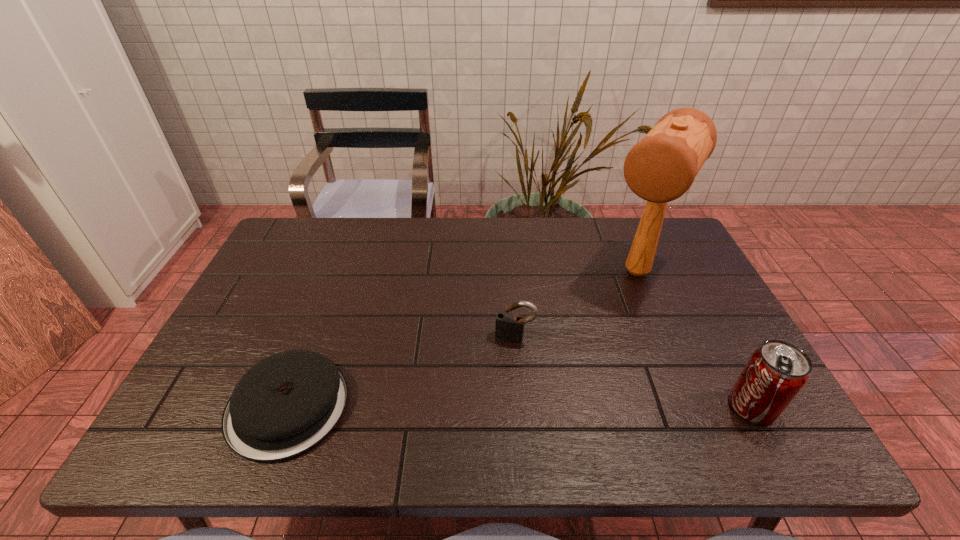
Where is `free space located on the strike surface of the mallet`? This screenshot has width=960, height=540. free space located on the strike surface of the mallet is located at coordinates (567, 384).

At what (x,y) coordinates should I click in order to perform the action: click on free location located on the strike surface of the mallet. Please return your answer as a coordinate pair (x, y). Looking at the image, I should click on (580, 364).

Image resolution: width=960 pixels, height=540 pixels. Identify the location of free space located 0.150m with the keyhole on the front of the second shortest object. (497, 392).

At what (x,y) coordinates should I click in order to perform the action: click on vacant position located with the keyhole on the front of the second shortest object. Please return your answer as a coordinate pair (x, y). The height and width of the screenshot is (540, 960). Looking at the image, I should click on (502, 374).

Where is `vacant space located 0.110m with the keyhole on the front of the second shortest object`? vacant space located 0.110m with the keyhole on the front of the second shortest object is located at coordinates (501, 377).

Where is `object that is at the far edge`? object that is at the far edge is located at coordinates (660, 168).

Where is `pancake that is at the near edge`? This screenshot has width=960, height=540. pancake that is at the near edge is located at coordinates (287, 403).

The height and width of the screenshot is (540, 960). In order to click on pop soda that is at the near edge in this screenshot , I will do `click(776, 372)`.

Where is `object located in the left edge section of the desktop`? The height and width of the screenshot is (540, 960). object located in the left edge section of the desktop is located at coordinates (287, 403).

You are a GUI agent. You are given a task and a screenshot of the screen. Output one action in this format:
    pyautogui.click(x=<x>, y=<y>)
    Task: Click on the pop soda located at the right edge
    This screenshot has width=960, height=540.
    Given the screenshot: What is the action you would take?
    pyautogui.click(x=776, y=372)